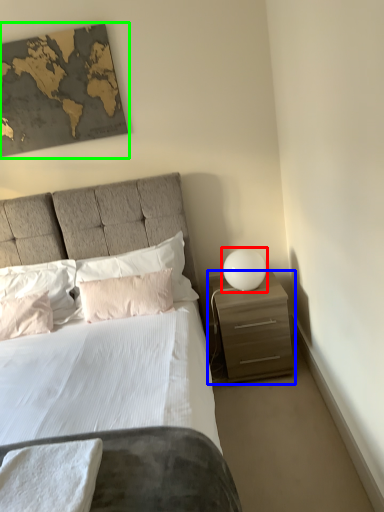
Question: Estimate the real-world distances between objects in this image. Which object is farther from table lamp (highlighted by a red box), nightstand (highlighted by a blue box) or picture frame (highlighted by a green box)?

Choices:
 (A) nightstand
 (B) picture frame

Answer: (B)